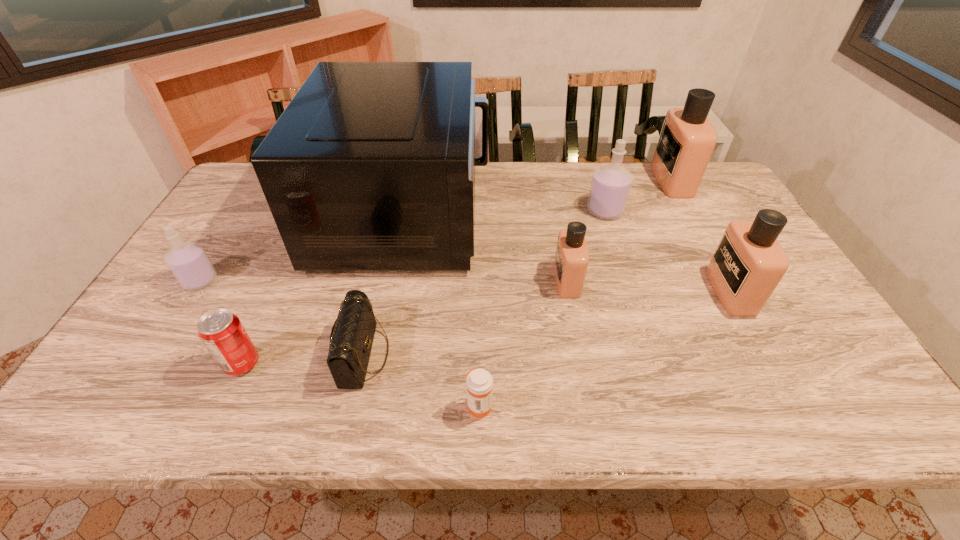
Where is `microwave_oven situated at the far edge`? The width and height of the screenshot is (960, 540). microwave_oven situated at the far edge is located at coordinates (371, 167).

You are a GUI agent. You are given a task and a screenshot of the screen. Output one action in this format:
    pyautogui.click(x=<x>, y=<y>)
    Task: Click on the clutch bag that is at the near edge
    The image size is (960, 540).
    Given the screenshot: What is the action you would take?
    pyautogui.click(x=351, y=339)

At what (x,y) coordinates should I click in order to perform the action: click on medicine that is at the near edge. Please return your answer as a coordinate pair (x, y). The image size is (960, 540). Looking at the image, I should click on (479, 382).

This screenshot has width=960, height=540. I want to click on object at the left edge, so click(x=189, y=263).

What are the coordinates of `object that is positioned at the far right corner` in the screenshot? It's located at (687, 139).

In the image, there is a desktop. Where is `free region at the far edge`? This screenshot has width=960, height=540. free region at the far edge is located at coordinates (544, 170).

In the image, there is a desktop. At what (x,y) coordinates should I click in order to perform the action: click on vacant space at the near edge. Please return your answer as a coordinate pair (x, y). Looking at the image, I should click on click(362, 421).

In the image, there is a desktop. In order to click on vacant space at the left edge in this screenshot , I will do `click(234, 204)`.

Identify the location of vacant space in between the clutch bag and the seventh tallest object. The image size is (960, 540). (303, 359).

This screenshot has height=540, width=960. In order to click on vacant space that's between the second biggest beige perfume and the clutch bag in this screenshot , I will do `click(547, 323)`.